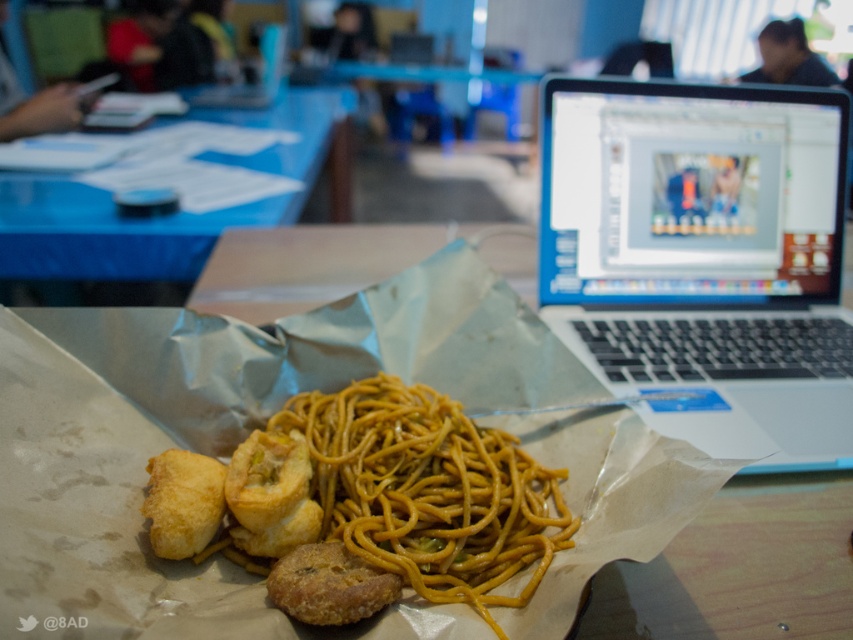
Question: Is brown paper bag at center closer to camera compared to golden crispy fried at center?

Choices:
 (A) no
 (B) yes

Answer: (A)

Question: Is silver metallic laptop at upper right above yellow matte spaghetti at center?

Choices:
 (A) no
 (B) yes

Answer: (B)

Question: Which point is farther from the camera taking this photo?

Choices:
 (A) (201, 113)
 (B) (213, 465)
 (C) (386, 515)

Answer: (A)

Question: Is yellow matte spaghetti at center closer to camera compared to golden fried chicken at lower left?

Choices:
 (A) no
 (B) yes

Answer: (B)

Question: Which object is farther from the camera taking this photo?

Choices:
 (A) silver metallic laptop at upper right
 (B) yellow matte spaghetti at center
 (C) blue plastic table at upper left

Answer: (C)

Question: Which of the following is the closest to the observer?

Choices:
 (A) (838, 611)
 (B) (427, 476)
 (C) (97, 259)
 (D) (827, 109)

Answer: (A)